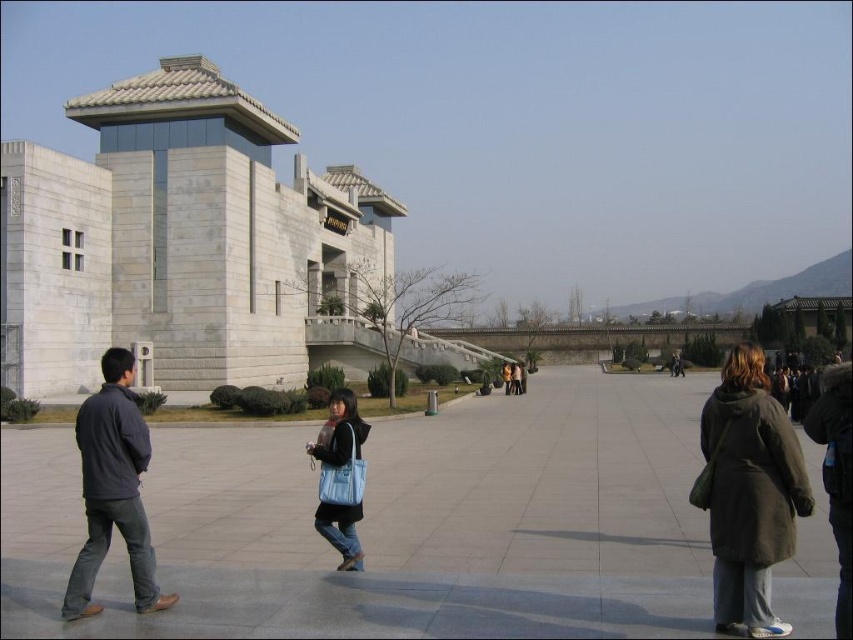
Can you confirm if white stone building at left is bigger than dark gray fleece jacket at lower left?

Yes.

Between white stone building at left and dark gray fleece jacket at lower left, which one appears on the right side from the viewer's perspective?

dark gray fleece jacket at lower left

In order to click on white stone building at left in this screenshot , I will do `click(178, 237)`.

Locate an element on the screen. The height and width of the screenshot is (640, 853). white stone building at left is located at coordinates (178, 237).

Does dark gray fleece jacket at lower left have a lesser width compared to matte blue bag at center?

No.

Between point (113, 499) and point (352, 403), which one is positioned in front?

Point (113, 499)

Between point (93, 566) and point (343, 518), which one is positioned behind?

Point (343, 518)

The width and height of the screenshot is (853, 640). In order to click on dark gray fleece jacket at lower left in this screenshot , I will do `click(113, 490)`.

Between dark gray fur coat at lower right and dark gray fleece jacket at lower left, which one has less height?

dark gray fur coat at lower right

Where is `dark gray fur coat at lower right`? This screenshot has height=640, width=853. dark gray fur coat at lower right is located at coordinates (750, 492).

Locate an element on the screen. This screenshot has height=640, width=853. dark gray fur coat at lower right is located at coordinates (750, 492).

Find the location of a particular element. dark gray fur coat at lower right is located at coordinates (750, 492).